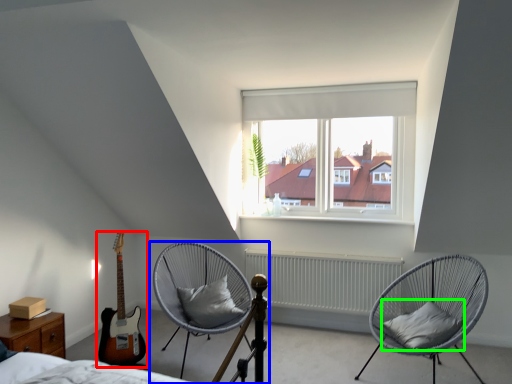
Question: Based on their relative distances, which object is nearer to guitar (highlighted by a red box)? Choose from chair (highlighted by a blue box) and pillow (highlighted by a green box).

Choices:
 (A) chair
 (B) pillow

Answer: (A)